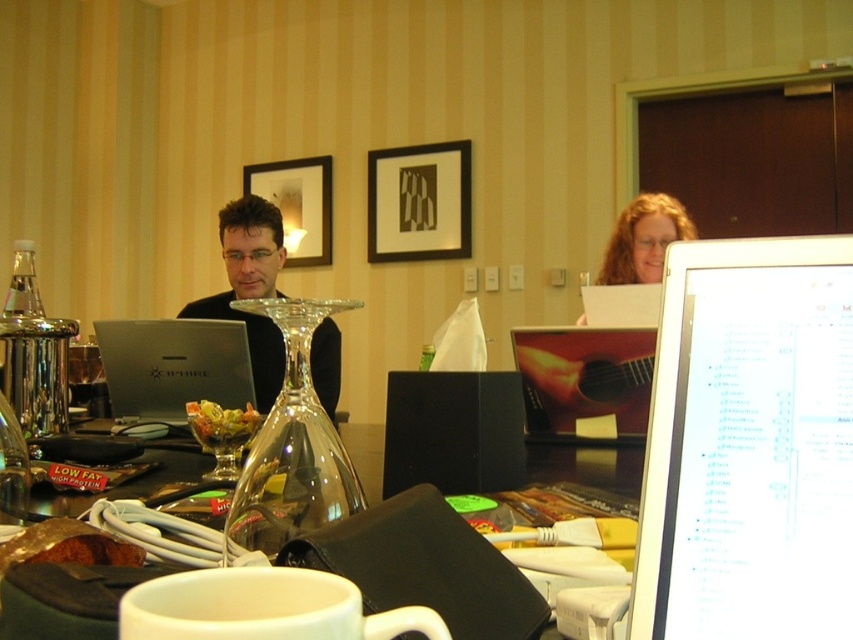
You are a delivery person who needs to place a 14 inch box on the desk. The white glossy computer monitor at upper right is already there. Is there enough space between them?

The white glossy computer monitor at upper right is 15.08 inches away from the edge of the desk, so placing a 14 inch box would fit as it is smaller than the available space.

You are organizing a presentation and need to place your matte black laptop at center on top of the translucent glass table at center. Can the laptop fit on the table without overhanging the edges?

The matte black laptop at center is much taller than the translucent glass table at center, so it cannot fit on the table without overhanging the edges.

In the scene shown: You are setting up a presentation and need to place both the white glossy computer monitor at upper right and the matte black laptop at center on a narrow shelf. Which device should you place first to ensure they both fit side by side?

The white glossy computer monitor at upper right is thinner than the matte black laptop at center, so you should place the matte black laptop at center first to accommodate its wider width before placing the thinner monitor.